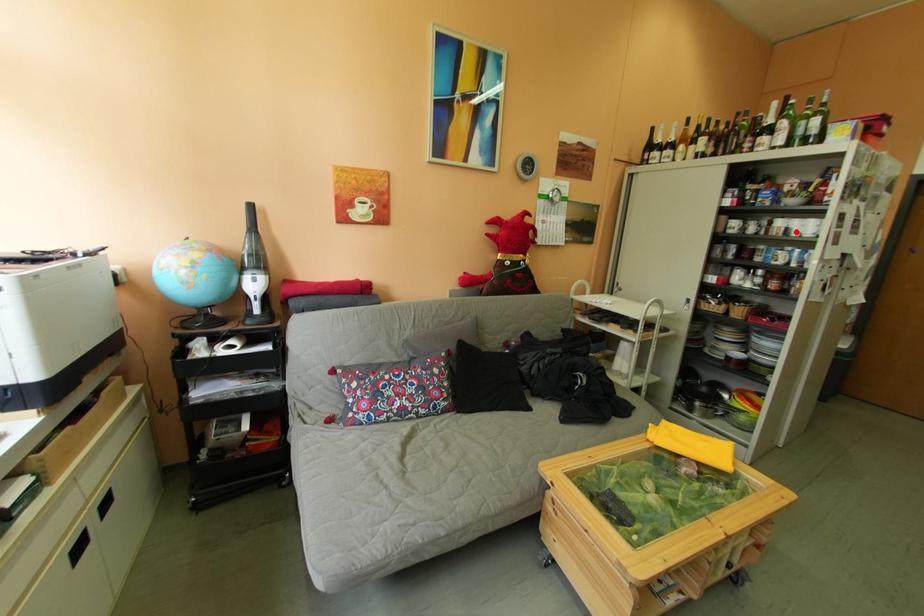
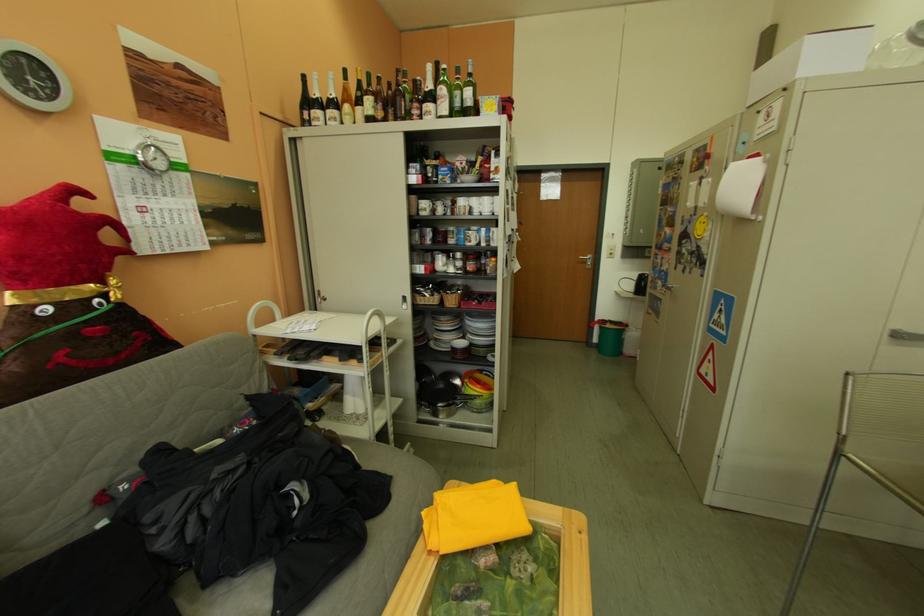
Find the pixel in the second image that matches the highlighted location in the first image.

(481, 211)